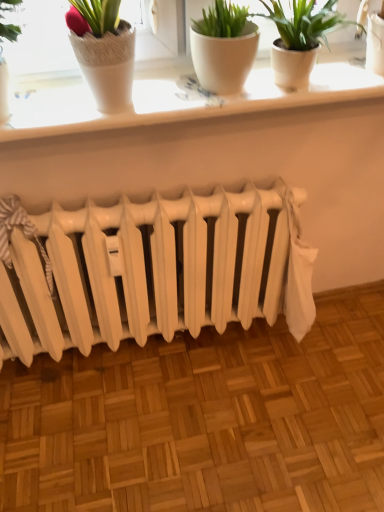
Question: Is the depth of white ceramic window sill at upper center less than that of white matte flowerpot at upper center?

Choices:
 (A) no
 (B) yes

Answer: (A)

Question: From the image's perspective, is white ceramic window sill at upper center located above white matte flowerpot at upper center?

Choices:
 (A) yes
 (B) no

Answer: (B)

Question: Is white ceramic window sill at upper center beside white matte flowerpot at upper center?

Choices:
 (A) yes
 (B) no

Answer: (B)

Question: From the image's perspective, is white ceramic window sill at upper center beneath white matte flowerpot at upper center?

Choices:
 (A) no
 (B) yes

Answer: (B)

Question: Can you confirm if white ceramic window sill at upper center is smaller than white matte flowerpot at upper center?

Choices:
 (A) no
 (B) yes

Answer: (A)

Question: Does white ceramic window sill at upper center have a greater height compared to white matte flowerpot at upper center?

Choices:
 (A) no
 (B) yes

Answer: (A)

Question: Can you confirm if white matte radiator at center is wider than white ceramic window sill at upper center?

Choices:
 (A) yes
 (B) no

Answer: (B)

Question: Are white matte radiator at center and white ceramic window sill at upper center located far from each other?

Choices:
 (A) yes
 (B) no

Answer: (B)

Question: Is white matte radiator at center at the left side of white ceramic window sill at upper center?

Choices:
 (A) yes
 (B) no

Answer: (A)

Question: From a real-world perspective, is white matte radiator at center on top of white ceramic window sill at upper center?

Choices:
 (A) no
 (B) yes

Answer: (A)

Question: Would you say white matte radiator at center is outside white ceramic window sill at upper center?

Choices:
 (A) no
 (B) yes

Answer: (B)

Question: Considering the relative sizes of white matte radiator at center and white ceramic window sill at upper center in the image provided, is white matte radiator at center thinner than white ceramic window sill at upper center?

Choices:
 (A) no
 (B) yes

Answer: (B)

Question: Is white matte flowerpot at upper center with white ceramic window sill at upper center?

Choices:
 (A) no
 (B) yes

Answer: (A)